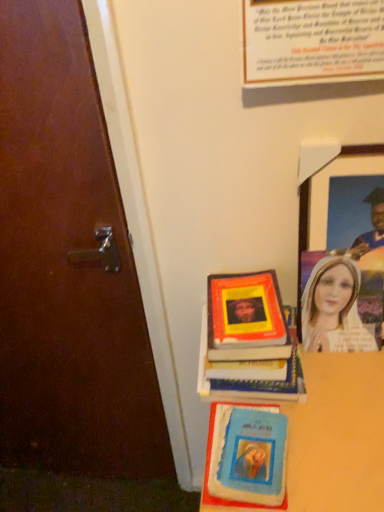
Question: Does smooth wooden table at lower right lie behind blue matte book at lower center?

Choices:
 (A) yes
 (B) no

Answer: (B)

Question: Is smooth wooden table at lower right facing towards blue matte book at lower center?

Choices:
 (A) no
 (B) yes

Answer: (A)

Question: Is smooth wooden table at lower right shorter than blue matte book at lower center?

Choices:
 (A) yes
 (B) no

Answer: (B)

Question: Is smooth wooden table at lower right taller than blue matte book at lower center?

Choices:
 (A) yes
 (B) no

Answer: (A)

Question: Can you confirm if smooth wooden table at lower right is wider than blue matte book at lower center?

Choices:
 (A) no
 (B) yes

Answer: (B)

Question: From the image's perspective, is hardcover book at center located above or below wooden picture frame at upper right?

Choices:
 (A) above
 (B) below

Answer: (B)

Question: Is hardcover book at center to the left or to the right of wooden picture frame at upper right in the image?

Choices:
 (A) right
 (B) left

Answer: (B)

Question: In terms of width, does hardcover book at center look wider or thinner when compared to wooden picture frame at upper right?

Choices:
 (A) wide
 (B) thin

Answer: (A)

Question: Based on their sizes in the image, would you say hardcover book at center is bigger or smaller than wooden picture frame at upper right?

Choices:
 (A) small
 (B) big

Answer: (A)

Question: Based on their positions, is blue matte book at lower center located to the left or right of hardcover book at center?

Choices:
 (A) left
 (B) right

Answer: (A)

Question: Is point (208, 416) positioned closer to the camera than point (249, 280)?

Choices:
 (A) farther
 (B) closer

Answer: (A)

Question: Based on their sizes in the image, would you say blue matte book at lower center is bigger or smaller than hardcover book at center?

Choices:
 (A) big
 (B) small

Answer: (B)

Question: Considering the positions of blue matte book at lower center and hardcover book at center in the image, is blue matte book at lower center taller or shorter than hardcover book at center?

Choices:
 (A) tall
 (B) short

Answer: (B)

Question: Considering the positions of smooth wooden table at lower right and hardcover book at center in the image, is smooth wooden table at lower right taller or shorter than hardcover book at center?

Choices:
 (A) tall
 (B) short

Answer: (A)

Question: Is point (372, 434) positioned closer to the camera than point (286, 384)?

Choices:
 (A) farther
 (B) closer

Answer: (B)